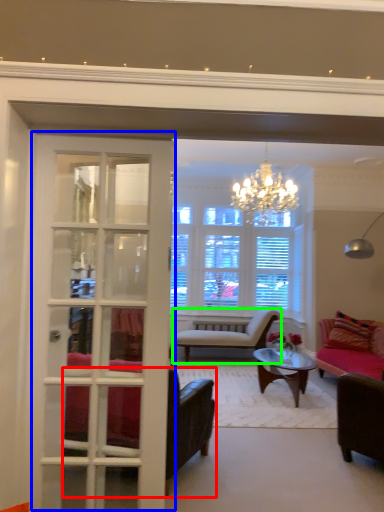
Question: Which object is the closest to the chair (highlighted by a red box)? Choose among these: door (highlighted by a blue box) or chair (highlighted by a green box).

Choices:
 (A) door
 (B) chair

Answer: (A)